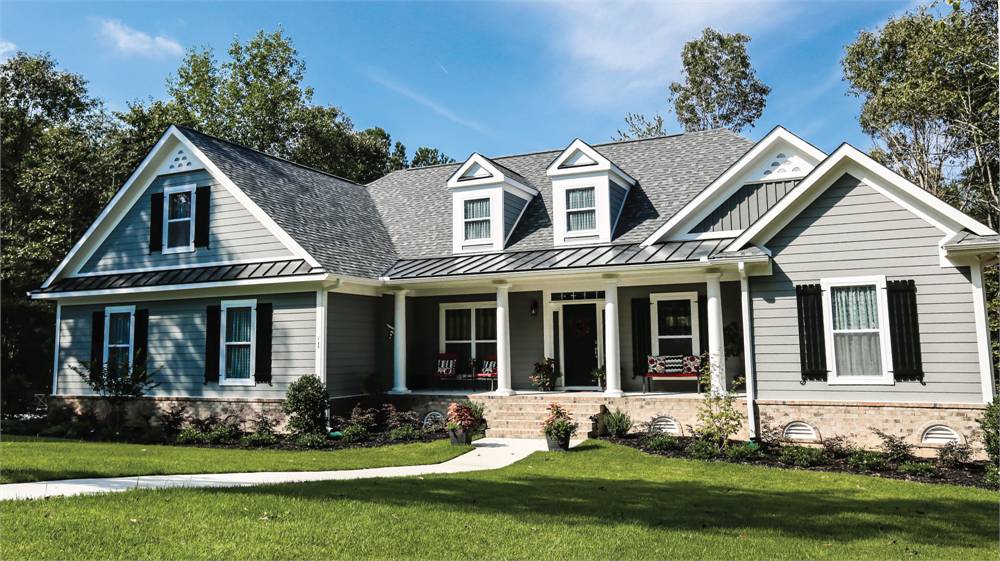
Find the location of a particular element. horizontal line of windows is located at coordinates (478, 217), (579, 209), (456, 339), (486, 338), (676, 335), (860, 329), (239, 343), (116, 346), (181, 219).